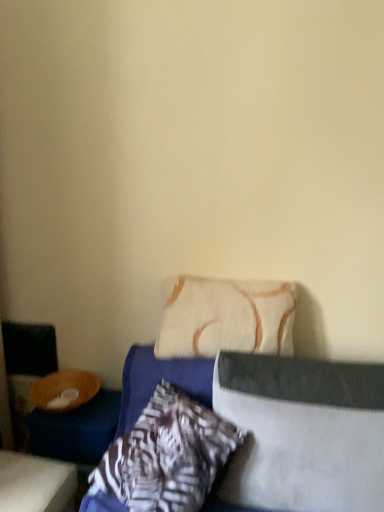
Question: From the image's perspective, does patterned fabric pillow at center, the third pillow positioned from the right, appear lower than textured blue bed at center?

Choices:
 (A) no
 (B) yes

Answer: (A)

Question: Is patterned fabric pillow at center, which is counted as the first pillow, starting from the left, touching textured blue bed at center?

Choices:
 (A) no
 (B) yes

Answer: (B)

Question: Is textured blue bed at center at the back of patterned fabric pillow at center, which is counted as the first pillow, starting from the left?

Choices:
 (A) yes
 (B) no

Answer: (A)

Question: Would you say patterned fabric pillow at center, which is counted as the first pillow, starting from the left, contains textured blue bed at center?

Choices:
 (A) yes
 (B) no

Answer: (B)

Question: Does patterned fabric pillow at center, the third pillow positioned from the right, have a larger size compared to textured blue bed at center?

Choices:
 (A) yes
 (B) no

Answer: (B)

Question: Considering the relative sizes of patterned fabric pillow at center, the third pillow positioned from the right, and textured blue bed at center in the image provided, is patterned fabric pillow at center, the third pillow positioned from the right, wider than textured blue bed at center?

Choices:
 (A) no
 (B) yes

Answer: (A)

Question: Is the depth of wooden table at lower left greater than that of patterned fabric pillow at center, which is counted as the first pillow, starting from the left?

Choices:
 (A) no
 (B) yes

Answer: (B)

Question: Is wooden table at lower left facing towards patterned fabric pillow at center, the third pillow positioned from the right?

Choices:
 (A) no
 (B) yes

Answer: (A)

Question: From a real-world perspective, does wooden table at lower left sit lower than patterned fabric pillow at center, the third pillow positioned from the right?

Choices:
 (A) no
 (B) yes

Answer: (B)

Question: Can you confirm if wooden table at lower left is taller than patterned fabric pillow at center, which is counted as the first pillow, starting from the left?

Choices:
 (A) no
 (B) yes

Answer: (A)

Question: Is wooden table at lower left positioned beyond the bounds of patterned fabric pillow at center, which is counted as the first pillow, starting from the left?

Choices:
 (A) no
 (B) yes

Answer: (B)

Question: Is wooden table at lower left far away from patterned fabric pillow at center, the third pillow positioned from the right?

Choices:
 (A) no
 (B) yes

Answer: (A)

Question: Is beige textured pillow at center, which is counted as the 2th pillow, starting from the right, not within textured blue bed at center?

Choices:
 (A) yes
 (B) no

Answer: (B)